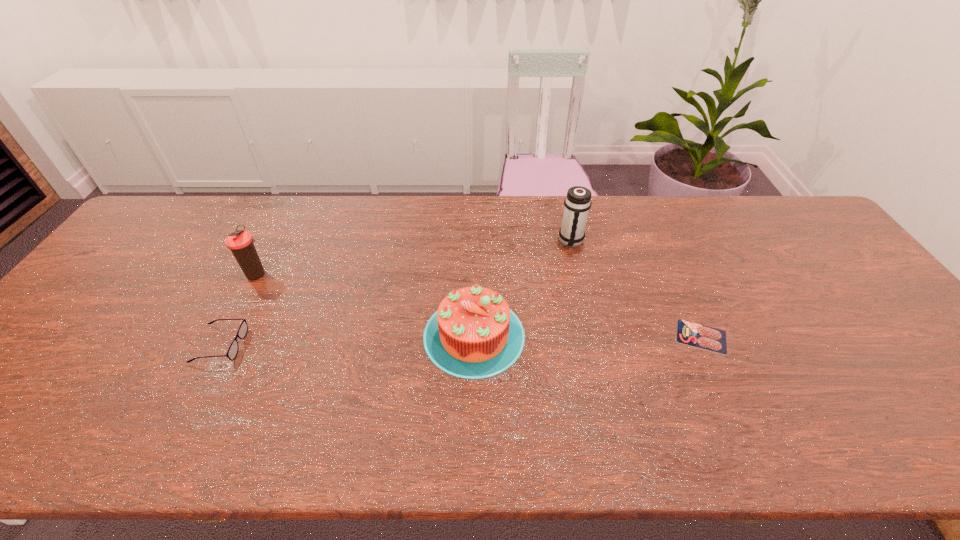
Find the location of a particular element. the farther thermos bottle is located at coordinates (577, 203).

Locate an element on the screen. the right thermos bottle is located at coordinates (577, 203).

Identify the location of the fourth nearest object. The height and width of the screenshot is (540, 960). (240, 242).

At what (x,y) coordinates should I click in order to perform the action: click on the left thermos bottle. Please return your answer as a coordinate pair (x, y). The width and height of the screenshot is (960, 540). Looking at the image, I should click on (240, 242).

Where is `cake`? cake is located at coordinates (473, 335).

At what (x,y) coordinates should I click in order to perform the action: click on the third tallest object. Please return your answer as a coordinate pair (x, y). The height and width of the screenshot is (540, 960). Looking at the image, I should click on (473, 335).

Identify the location of the fourth tallest object. (232, 352).

Where is `the rightmost object`? The width and height of the screenshot is (960, 540). the rightmost object is located at coordinates (688, 333).

Locate an element on the screen. the shortest object is located at coordinates (688, 333).

Locate an element on the screen. Image resolution: width=960 pixels, height=540 pixels. free space located 0.220m on the side with the handle of the fourth object from left to right is located at coordinates click(586, 307).